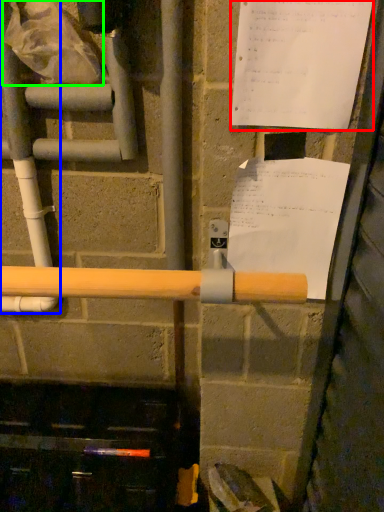
Question: Which is farther away from paper (highlighted by a red box)? water pipe (highlighted by a blue box) or plastic bag (highlighted by a green box)?

Choices:
 (A) water pipe
 (B) plastic bag

Answer: (A)